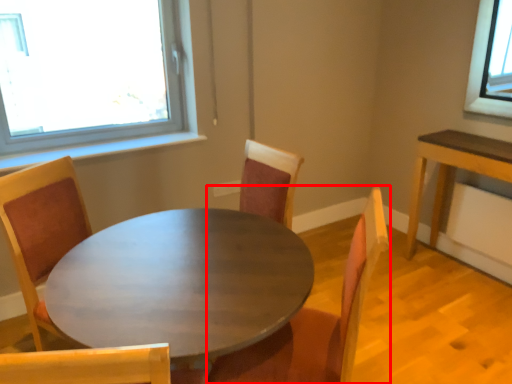
Question: Observing the image, what is the correct spatial positioning of chair (annotated by the red box) in reference to coffee table?

Choices:
 (A) left
 (B) right

Answer: (B)